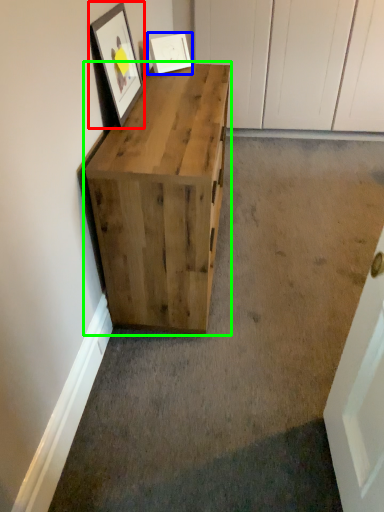
Question: Estimate the real-world distances between objects in this image. Which object is closer to picture frame (highlighted by a red box), picture frame (highlighted by a blue box) or chest of drawers (highlighted by a green box)?

Choices:
 (A) picture frame
 (B) chest of drawers

Answer: (B)